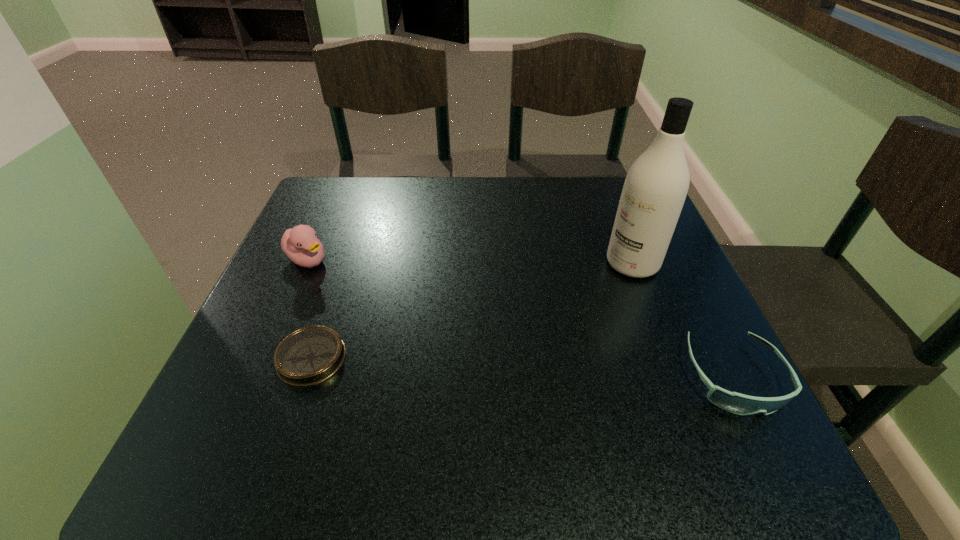
I want to click on compass, so click(x=310, y=355).

The width and height of the screenshot is (960, 540). What are the coordinates of `goggles` in the screenshot? It's located at (737, 403).

Where is `the tallest object`? This screenshot has height=540, width=960. the tallest object is located at coordinates [x=655, y=188].

At what (x,y) coordinates should I click in order to perform the action: click on the second tallest object. Please return your answer as a coordinate pair (x, y). The height and width of the screenshot is (540, 960). Looking at the image, I should click on (300, 244).

Where is `free space located 0.120m on the right of the compass`? This screenshot has height=540, width=960. free space located 0.120m on the right of the compass is located at coordinates (412, 358).

You are a GUI agent. You are given a task and a screenshot of the screen. Output one action in this format:
    pyautogui.click(x=<x>, y=<y>)
    Task: Click on the free space located on the front-facing side of the tallest object
    
    Given the screenshot: What is the action you would take?
    pyautogui.click(x=568, y=302)

Locate an element on the screen. The image size is (960, 540). vacant space situated on the front-facing side of the tallest object is located at coordinates (467, 362).

The height and width of the screenshot is (540, 960). I want to click on vacant space located 0.300m on the front-facing side of the tallest object, so click(x=506, y=339).

Identify the location of free space located on the front-facing side of the second tallest object. [352, 285].

Find the location of a particular element. The image size is (960, 540). blank area located 0.330m on the front-facing side of the second tallest object is located at coordinates (441, 338).